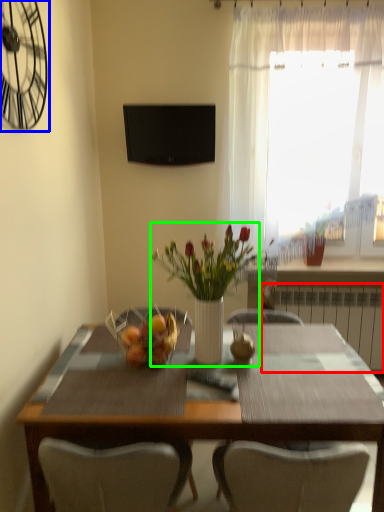
Question: Which object is the farthest from radiator (highlighted by a red box)? Choose among these: clock (highlighted by a blue box) or floral arrangement (highlighted by a green box).

Choices:
 (A) clock
 (B) floral arrangement

Answer: (A)